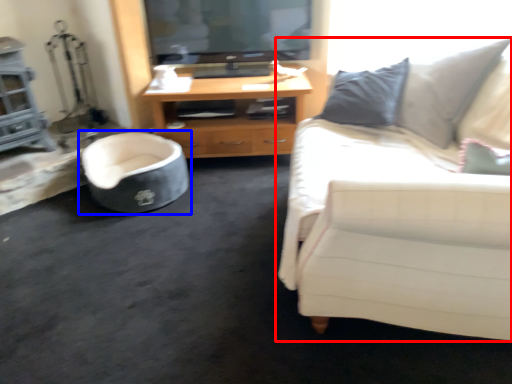
Question: Which point is closer to the camera, studio couch (highlighted by a red box) or chair (highlighted by a blue box)?

Choices:
 (A) studio couch
 (B) chair

Answer: (A)